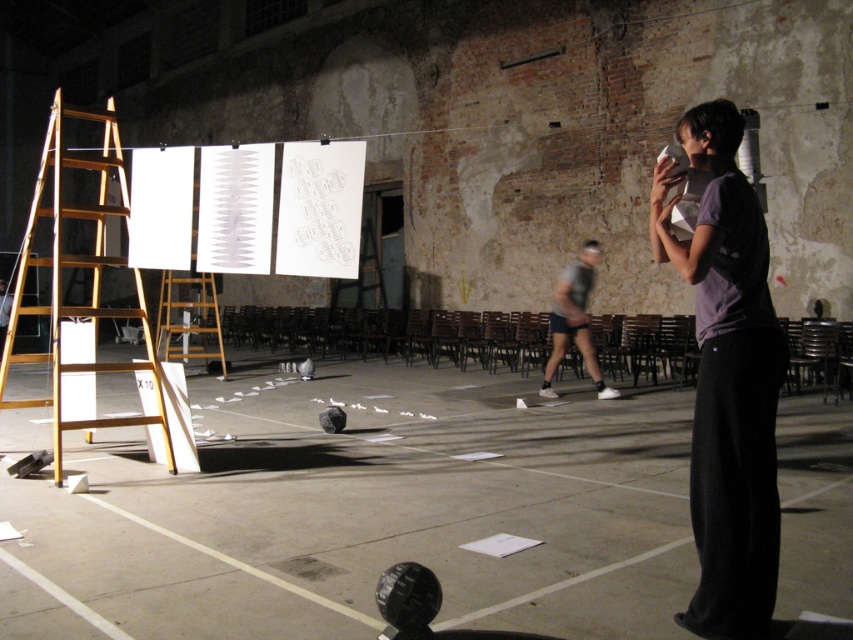
Which is in front, point (668, 234) or point (596, 388)?

Point (668, 234)

Can you confirm if purple cotton shirt at right is bigger than gray fabric shorts at center?

Actually, purple cotton shirt at right might be smaller than gray fabric shorts at center.

Which is behind, point (735, 291) or point (553, 330)?

Point (553, 330)

Identify the location of purple cotton shirt at right. This screenshot has height=640, width=853. (727, 380).

Describe the element at coordinates (79, 276) in the screenshot. I see `wooden at left` at that location.

Can you confirm if wooden at left is positioned below wooden ladder at center?

Incorrect, wooden at left is not positioned below wooden ladder at center.

Does point (102, 196) come in front of point (196, 276)?

Yes.

You are a GUI agent. You are given a task and a screenshot of the screen. Output one action in this format:
    pyautogui.click(x=<x>, y=<y>)
    Task: Click on the wooden at left
    
    Given the screenshot: What is the action you would take?
    pyautogui.click(x=79, y=276)

Between purple cotton shirt at right and wooden ladder at center, which one appears on the left side from the viewer's perspective?

wooden ladder at center

Does purple cotton shirt at right have a larger size compared to wooden ladder at center?

No.

Where is `purple cotton shirt at right`? purple cotton shirt at right is located at coordinates (727, 380).

Find the location of `purple cotton shirt at right`. purple cotton shirt at right is located at coordinates (727, 380).